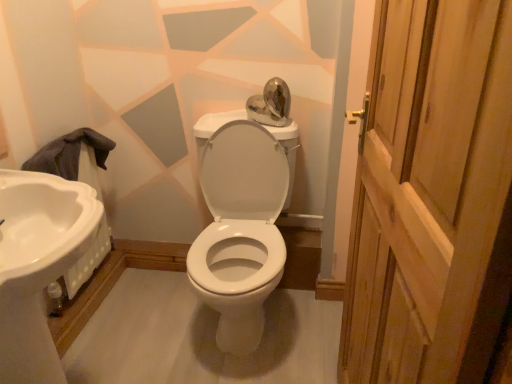
This screenshot has width=512, height=384. I want to click on free space to the left of white glossy porcelain at center, so click(x=146, y=317).